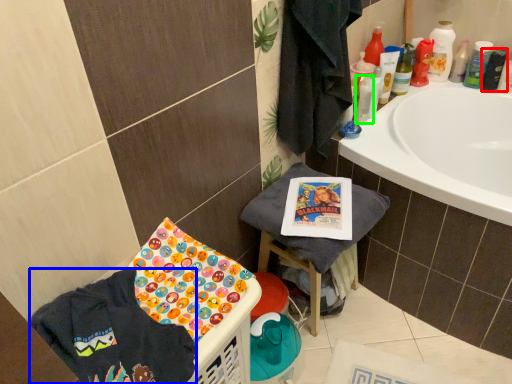
Question: Which object is positioned closest to mouthwash (highlighted by a red box)? Select from clothing (highlighted by a blue box) and mouthwash (highlighted by a green box).

Choices:
 (A) clothing
 (B) mouthwash

Answer: (B)